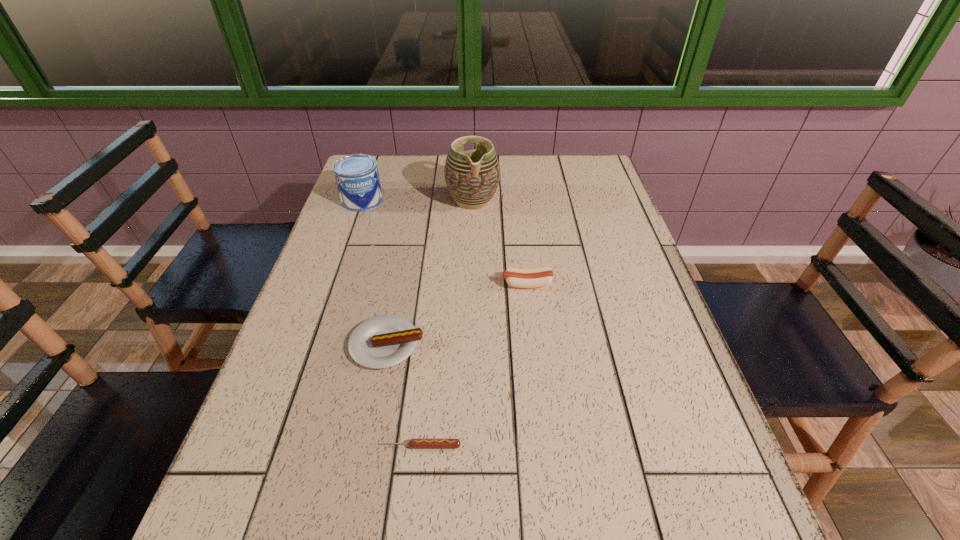
This screenshot has width=960, height=540. In order to click on empty location between the pottery and the second tallest object in this screenshot , I will do `click(418, 200)`.

Locate which object is the closest to the tallest object. Please provide its 2D coordinates. Your answer should be formatted as a tuple, i.e. [(x, y)], where the tuple contains the x and y coordinates of a point satisfying the conditions above.

[(357, 177)]

Identify which object is the second closest to the shortest object. Please provide its 2D coordinates. Your answer should be formatted as a tuple, i.e. [(x, y)], where the tuple contains the x and y coordinates of a point satisfying the conditions above.

[(515, 277)]

The height and width of the screenshot is (540, 960). In order to click on the third closest sausage relative to the can in this screenshot , I will do `click(416, 443)`.

At what (x,y) coordinates should I click in order to perform the action: click on the second closest sausage to the tallest object. Please return your answer as a coordinate pair (x, y). Looking at the image, I should click on (383, 341).

The width and height of the screenshot is (960, 540). I want to click on free space that satisfies the following two spatial constraints: 1. on the front label of the fourth shortest object; 2. on the left side of the rightmost sausage, so click(333, 284).

The height and width of the screenshot is (540, 960). Find the location of `vacant position in the image that satisfies the following two spatial constraints: 1. on the front label of the second tallest object; 2. on the right side of the third nearest object`. vacant position in the image that satisfies the following two spatial constraints: 1. on the front label of the second tallest object; 2. on the right side of the third nearest object is located at coordinates (333, 284).